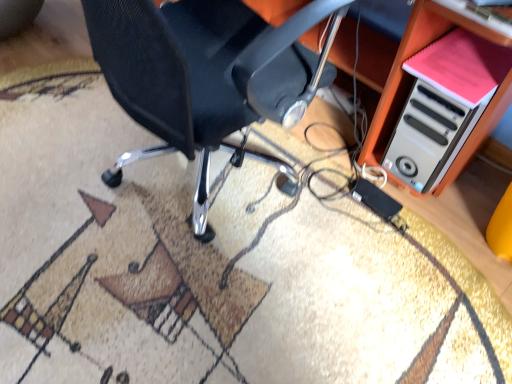
Question: From their relative heights in the image, would you say white plastic computer case at lower right is taller or shorter than black mesh chair at center?

Choices:
 (A) short
 (B) tall

Answer: (A)

Question: Looking at the image, does white plastic computer case at lower right seem bigger or smaller compared to black mesh chair at center?

Choices:
 (A) small
 (B) big

Answer: (A)

Question: Which of these objects is positioned farthest from the white plastic computer case at lower right?

Choices:
 (A) black mesh chair at center
 (B) white plastic computer tower at right
 (C) pink matte book at upper right

Answer: (A)

Question: Considering the real-world distances, which object is closest to the pink matte book at upper right?

Choices:
 (A) black mesh chair at center
 (B) white plastic computer case at lower right
 (C) white plastic computer tower at right

Answer: (B)